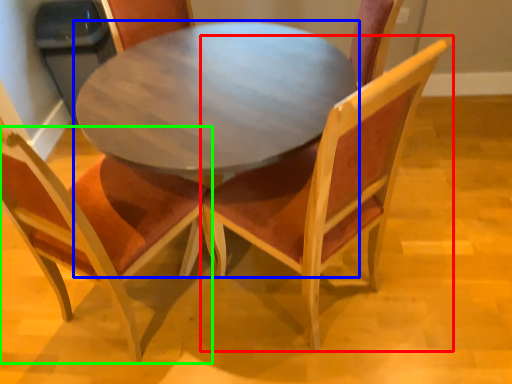
Question: Which object is the closest to the chair (highlighted by a red box)? Choose among these: coffee table (highlighted by a blue box) or chair (highlighted by a green box).

Choices:
 (A) coffee table
 (B) chair

Answer: (A)